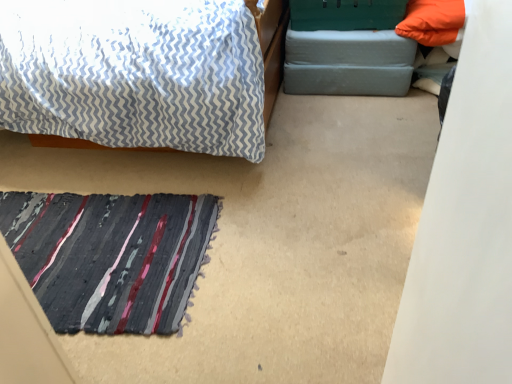
Question: Can you confirm if textured striped mat at lower left is thinner than gray fabric footrest at upper right?

Choices:
 (A) no
 (B) yes

Answer: (A)

Question: Considering the relative sizes of textured striped mat at lower left and gray fabric footrest at upper right in the image provided, is textured striped mat at lower left bigger than gray fabric footrest at upper right?

Choices:
 (A) yes
 (B) no

Answer: (B)

Question: From a real-world perspective, is textured striped mat at lower left beneath gray fabric footrest at upper right?

Choices:
 (A) no
 (B) yes

Answer: (B)

Question: Is the position of textured striped mat at lower left less distant than that of gray fabric footrest at upper right?

Choices:
 (A) no
 (B) yes

Answer: (B)

Question: Is textured striped mat at lower left behind gray fabric footrest at upper right?

Choices:
 (A) no
 (B) yes

Answer: (A)

Question: Does textured striped mat at lower left have a smaller size compared to gray fabric footrest at upper right?

Choices:
 (A) no
 (B) yes

Answer: (B)

Question: Does gray fabric footrest at upper right appear on the right side of textured striped mat at lower left?

Choices:
 (A) yes
 (B) no

Answer: (A)

Question: Is gray fabric footrest at upper right at the left side of textured striped mat at lower left?

Choices:
 (A) no
 (B) yes

Answer: (A)

Question: Can you confirm if gray fabric footrest at upper right is bigger than textured striped mat at lower left?

Choices:
 (A) yes
 (B) no

Answer: (A)

Question: Considering the relative sizes of gray fabric footrest at upper right and textured striped mat at lower left in the image provided, is gray fabric footrest at upper right taller than textured striped mat at lower left?

Choices:
 (A) no
 (B) yes

Answer: (B)

Question: Could you tell me if gray fabric footrest at upper right is facing textured striped mat at lower left?

Choices:
 (A) yes
 (B) no

Answer: (A)

Question: Does gray fabric footrest at upper right come behind textured striped mat at lower left?

Choices:
 (A) no
 (B) yes

Answer: (B)

Question: From the image's perspective, is textured striped mat at lower left located above or below gray fabric footrest at upper right?

Choices:
 (A) above
 (B) below

Answer: (B)